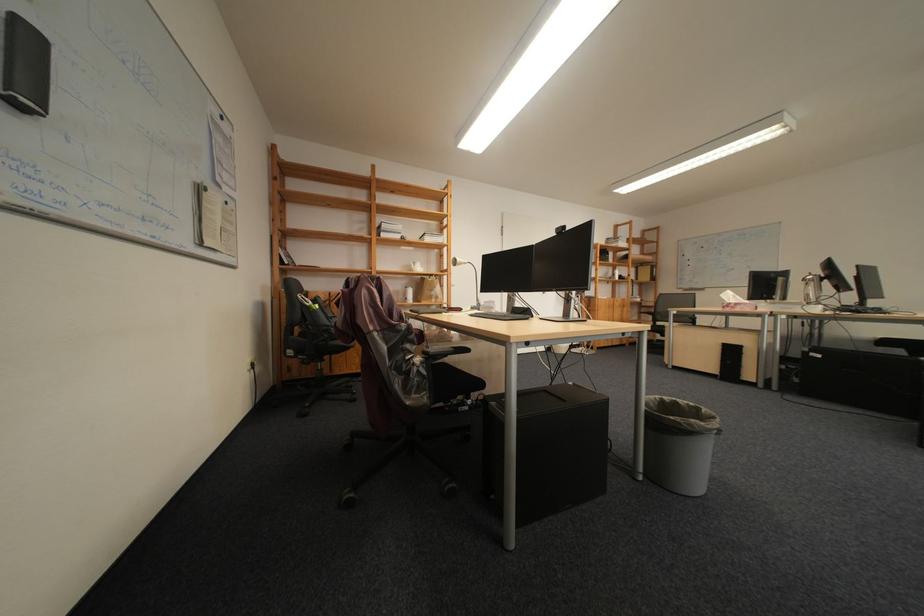
Which object does [407,294] point to?

This point indicates the white ceramic cup.